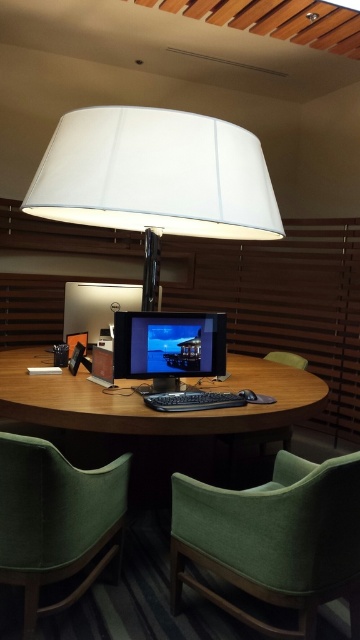
Is green fabric swivel chair at lower center above green fabric swivel chair at lower left?

No.

Is point (358, 572) less distant than point (114, 486)?

Yes, point (358, 572) is closer to viewer.

Where is `green fabric swivel chair at lower center`? green fabric swivel chair at lower center is located at coordinates (273, 540).

This screenshot has height=640, width=360. Identify the location of white matte lampshade at upper center. (155, 179).

Does green fabric swivel chair at lower left appear on the left side of woodenmaterial/texturedesk at center?

Correct, you'll find green fabric swivel chair at lower left to the left of woodenmaterial/texturedesk at center.

Does green fabric swivel chair at lower left appear over woodenmaterial/texturedesk at center?

No.

Who is more distant from viewer, (87, 550) or (205, 416)?

Point (205, 416)

What are the coordinates of `green fabric swivel chair at lower left` in the screenshot? It's located at [55, 518].